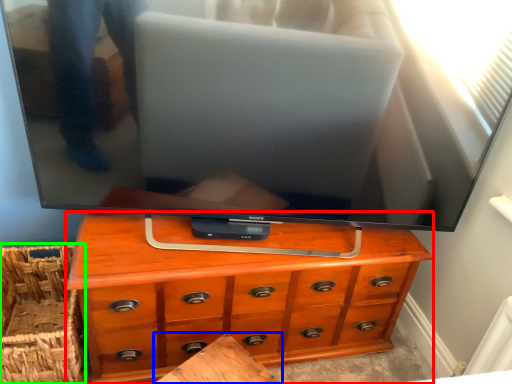
Question: Which is nearer to the chest of drawers (highlighted by a red box)? table (highlighted by a blue box) or basket (highlighted by a green box).

Choices:
 (A) table
 (B) basket

Answer: (A)